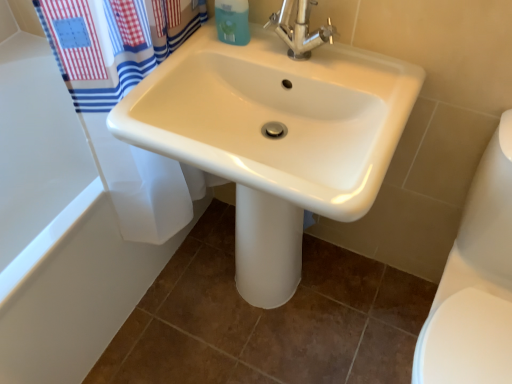
Identify the location of free space that is in between chrome metallic faucet at upper center and blue matte soap dispenser at upper center. (251, 55).